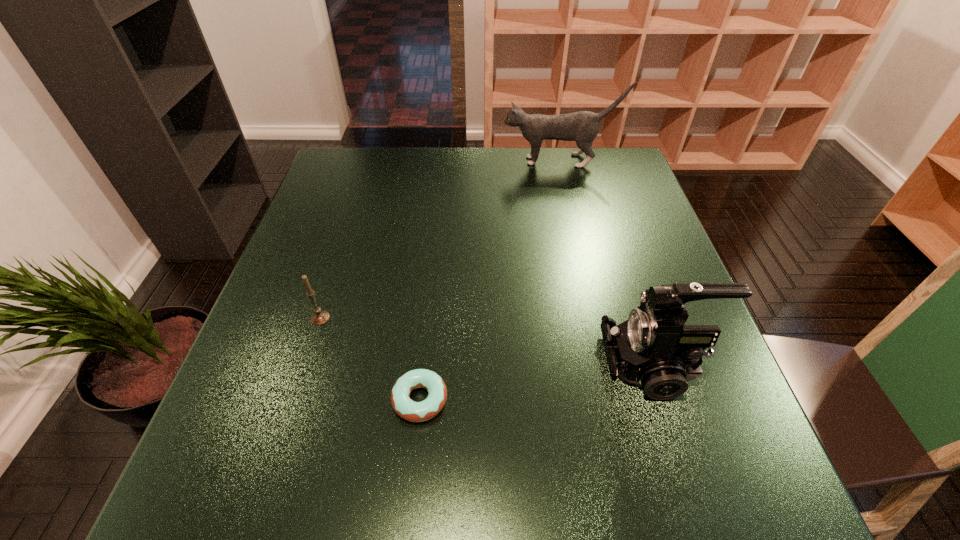
The width and height of the screenshot is (960, 540). What are the coordinates of `the farthest object` in the screenshot? It's located at (583, 126).

This screenshot has height=540, width=960. Identify the location of camcorder. (653, 349).

I want to click on candle, so click(320, 317).

You are a GUI agent. You are given a task and a screenshot of the screen. Output one action in this format:
    pyautogui.click(x=<x>, y=<y>)
    Task: Click on the third nearest object
    This screenshot has height=540, width=960.
    Given the screenshot: What is the action you would take?
    pyautogui.click(x=320, y=317)

The height and width of the screenshot is (540, 960). I want to click on the second object from left to right, so click(x=412, y=411).

Where is `the shortest object`? the shortest object is located at coordinates (412, 411).

Identify the location of vacant space located at the face of the farthest object. (467, 161).

Find the location of `free location located 0.340m at the face of the farthest object`. free location located 0.340m at the face of the farthest object is located at coordinates (393, 161).

Where is `free spot located at the face of the farthest object`? The width and height of the screenshot is (960, 540). free spot located at the face of the farthest object is located at coordinates (396, 161).

You are a GUI agent. You are given a task and a screenshot of the screen. Output one action in this format:
    pyautogui.click(x=<x>, y=<y>)
    Task: Click on the free space located on the lens mount of the camcorder
    Image resolution: width=960 pixels, height=540 pixels.
    Given the screenshot: What is the action you would take?
    pyautogui.click(x=516, y=363)